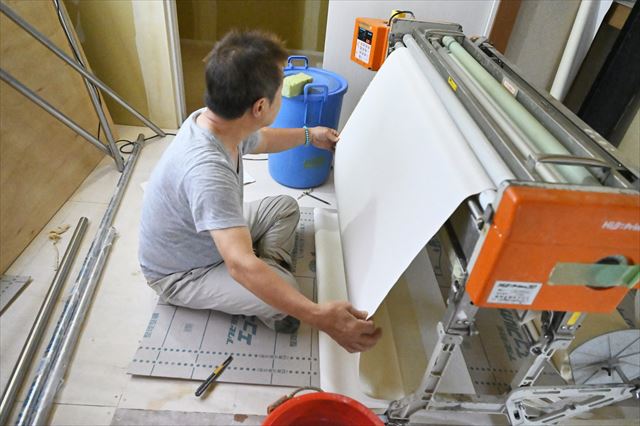
Find the location of `sponge`. sponge is located at coordinates (292, 86).